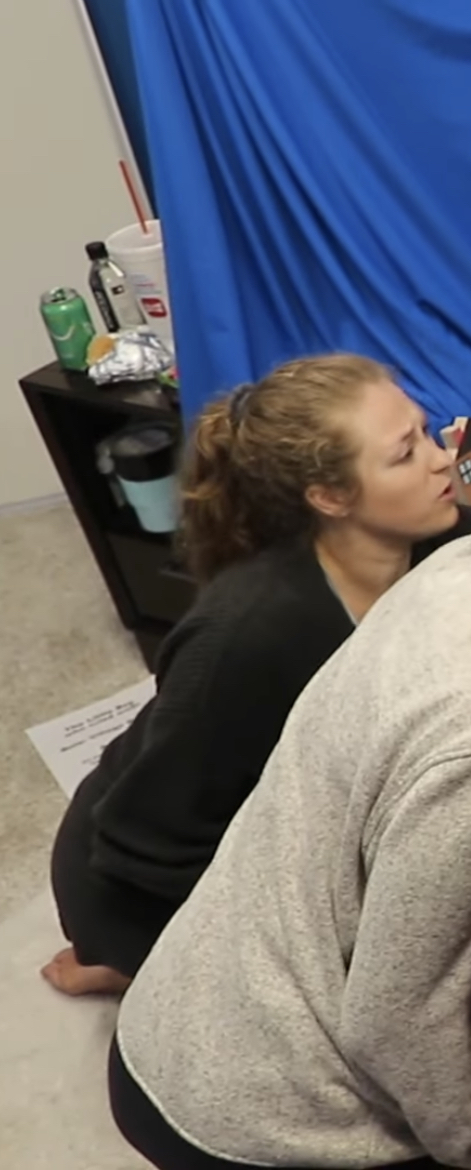
Where is `blue curtain`? blue curtain is located at coordinates (328, 98).